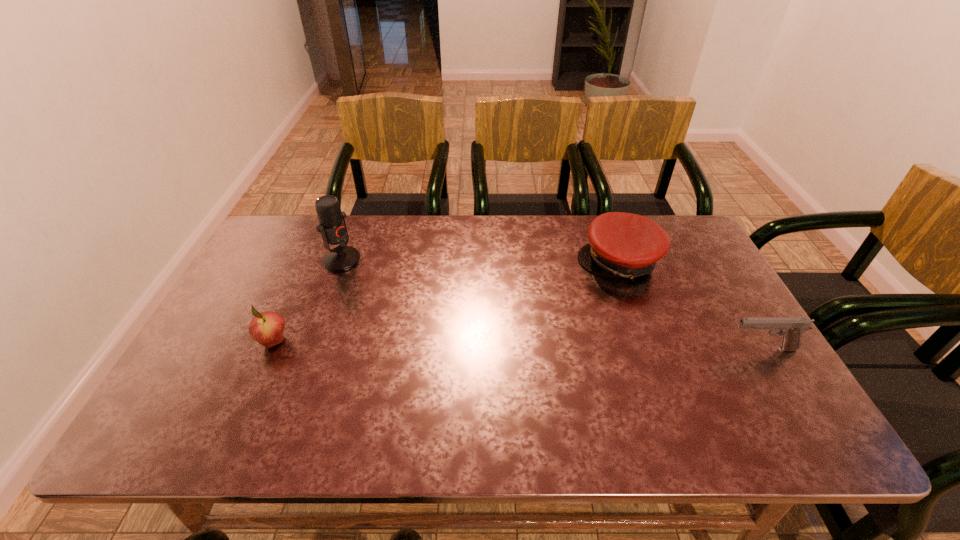
In order to click on vacant region located 0.330m at the front of the cap where the visor is located in this screenshot , I will do `click(515, 335)`.

The height and width of the screenshot is (540, 960). I want to click on vacant space positioned at the front of the cap where the visor is located, so click(x=520, y=331).

At what (x,y) coordinates should I click in order to perform the action: click on blank space located on the side of the tallest object with the red ring. Please return your answer as a coordinate pair (x, y). This screenshot has width=960, height=540. Looking at the image, I should click on (433, 309).

At what (x,y) coordinates should I click in order to perform the action: click on vacant point located on the side of the tallest object with the red ring. Please return your answer as a coordinate pair (x, y). Image resolution: width=960 pixels, height=540 pixels. Looking at the image, I should click on (427, 307).

The image size is (960, 540). Find the location of `vacant space located 0.390m on the side of the tallest object with the red ring`. vacant space located 0.390m on the side of the tallest object with the red ring is located at coordinates (456, 322).

Identify the location of cap situated at the far edge. This screenshot has width=960, height=540. (627, 245).

Find the location of a particular element. microphone that is at the far edge is located at coordinates (332, 226).

At what (x,y) coordinates should I click in order to perform the action: click on object at the left edge. Please return your answer as a coordinate pair (x, y). Image resolution: width=960 pixels, height=540 pixels. Looking at the image, I should click on (267, 328).

I want to click on pistol at the right edge, so click(x=791, y=329).

This screenshot has width=960, height=540. I want to click on cap that is positioned at the right edge, so click(x=627, y=245).